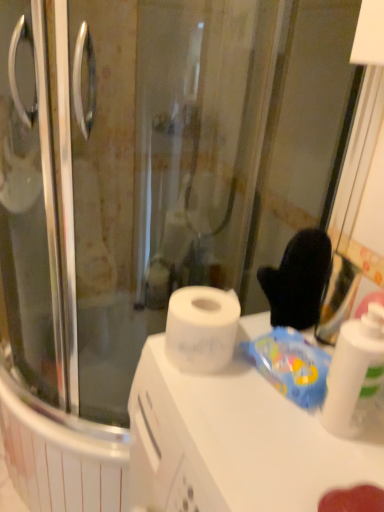
Question: From a real-world perspective, is white glossy bottle at right located beneath white matte counter top at center?

Choices:
 (A) no
 (B) yes

Answer: (A)

Question: From the image's perspective, is white glossy bottle at right located beneath white matte counter top at center?

Choices:
 (A) yes
 (B) no

Answer: (B)

Question: Are white glossy bottle at right and white matte counter top at center far apart?

Choices:
 (A) yes
 (B) no

Answer: (B)

Question: Would you say white glossy bottle at right is outside white matte counter top at center?

Choices:
 (A) yes
 (B) no

Answer: (A)

Question: From the image's perspective, is white glossy bottle at right on top of white matte counter top at center?

Choices:
 (A) yes
 (B) no

Answer: (A)

Question: Considering their positions, is blue plastic bag at upper right located in front of or behind white glossy bottle at right?

Choices:
 (A) behind
 (B) front

Answer: (A)

Question: Based on their sizes in the image, would you say blue plastic bag at upper right is bigger or smaller than white glossy bottle at right?

Choices:
 (A) big
 (B) small

Answer: (B)

Question: In terms of width, does blue plastic bag at upper right look wider or thinner when compared to white glossy bottle at right?

Choices:
 (A) wide
 (B) thin

Answer: (A)

Question: Do you think blue plastic bag at upper right is within white glossy bottle at right, or outside of it?

Choices:
 (A) inside
 (B) outside

Answer: (B)

Question: Is white glossy bottle at right wider or thinner than blue plastic bag at upper right?

Choices:
 (A) thin
 (B) wide

Answer: (A)

Question: From a real-world perspective, relative to blue plastic bag at upper right, is white glossy bottle at right vertically above or below?

Choices:
 (A) below
 (B) above

Answer: (B)

Question: In the image, is white glossy bottle at right on the left side or the right side of blue plastic bag at upper right?

Choices:
 (A) right
 (B) left

Answer: (A)

Question: Relative to blue plastic bag at upper right, is white glossy bottle at right in front or behind?

Choices:
 (A) behind
 (B) front

Answer: (B)

Question: Is blue plastic bag at upper right in front of or behind white matte counter top at center in the image?

Choices:
 (A) front
 (B) behind

Answer: (B)

Question: Do you think blue plastic bag at upper right is within white matte counter top at center, or outside of it?

Choices:
 (A) outside
 (B) inside

Answer: (A)